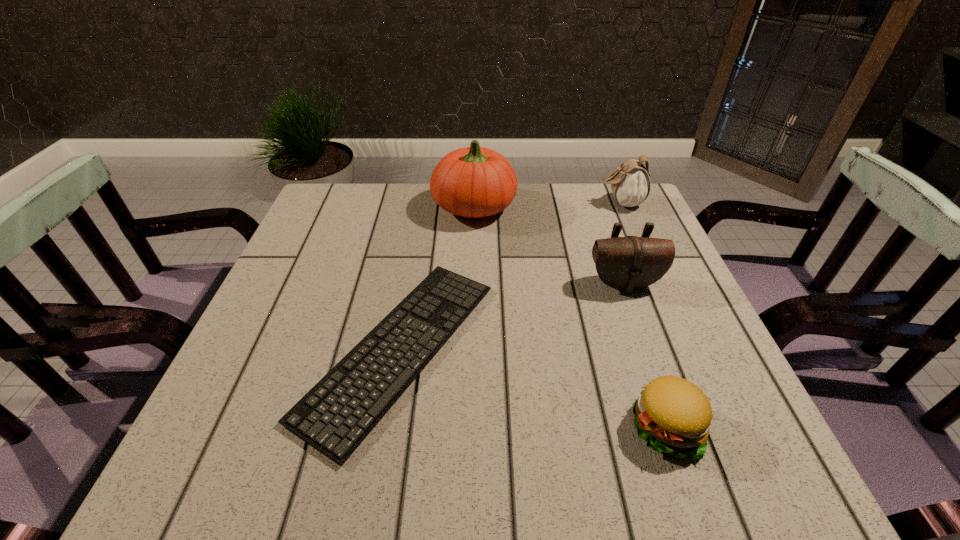
Locate an element on the screen. The width and height of the screenshot is (960, 540). pumpkin is located at coordinates (474, 182).

The height and width of the screenshot is (540, 960). I want to click on the nearer pouch, so click(x=630, y=263).

The image size is (960, 540). In order to click on the farther pouch in this screenshot , I will do `click(630, 183)`.

Locate an element on the screen. Image resolution: width=960 pixels, height=540 pixels. the fourth tallest object is located at coordinates (673, 415).

The height and width of the screenshot is (540, 960). Identify the location of the shortest object. (335, 416).

The width and height of the screenshot is (960, 540). What are the coordinates of `free space located 0.240m on the right of the pumpkin` in the screenshot? It's located at (603, 207).

The height and width of the screenshot is (540, 960). What are the coordinates of `vacant space situated with the flap open on the nearer pouch` in the screenshot? It's located at (685, 457).

Locate an element on the screen. vacant position located 0.050m on the front-facing side of the farther pouch is located at coordinates (581, 203).

Find the location of a particular element. This screenshot has height=540, width=960. vacant space located 0.190m on the front-facing side of the farther pouch is located at coordinates (531, 203).

Where is `free space located on the front-facing side of the farther pouch`? The image size is (960, 540). free space located on the front-facing side of the farther pouch is located at coordinates (x=460, y=203).